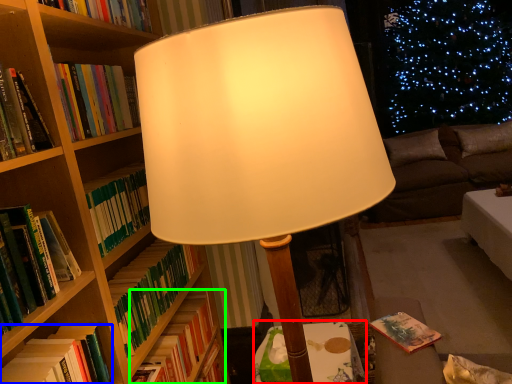
Question: Which object is positioned farthest from table (highlighted by a red box)? Select from book (highlighted by a blue box) and book (highlighted by a green box).

Choices:
 (A) book
 (B) book

Answer: (A)